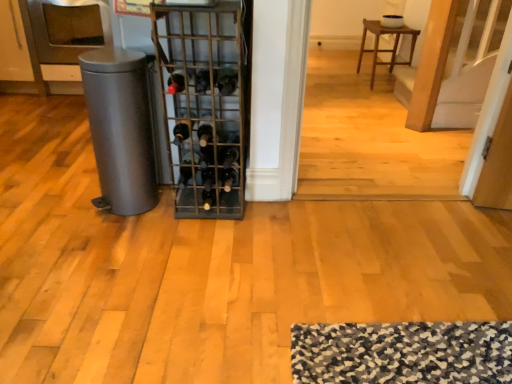
Find the location of `vacant space that is to the left of matte gray trash can at left`. vacant space that is to the left of matte gray trash can at left is located at coordinates (70, 208).